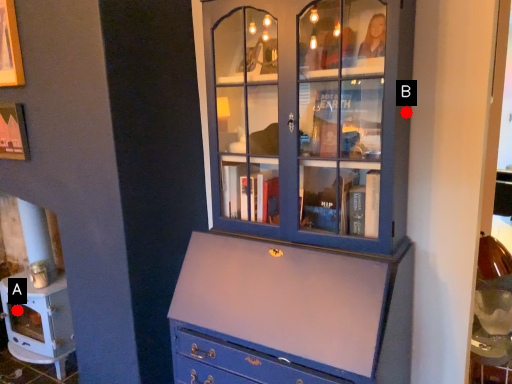
Question: Two points are circled on the image, labeled by A and B beside each circle. Which point is further to the camera?

Choices:
 (A) A is further
 (B) B is further

Answer: (A)